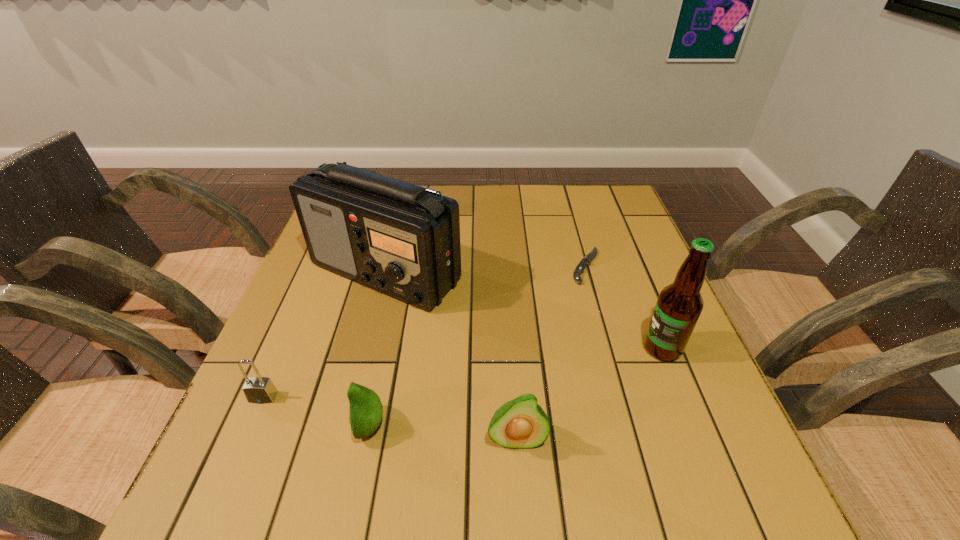
Image resolution: width=960 pixels, height=540 pixels. Identify the location of vacant position in the image that satisfies the following two spatial constraints: 1. on the label of the beer bottle; 2. on the cut side of the third tallest object. (698, 439).